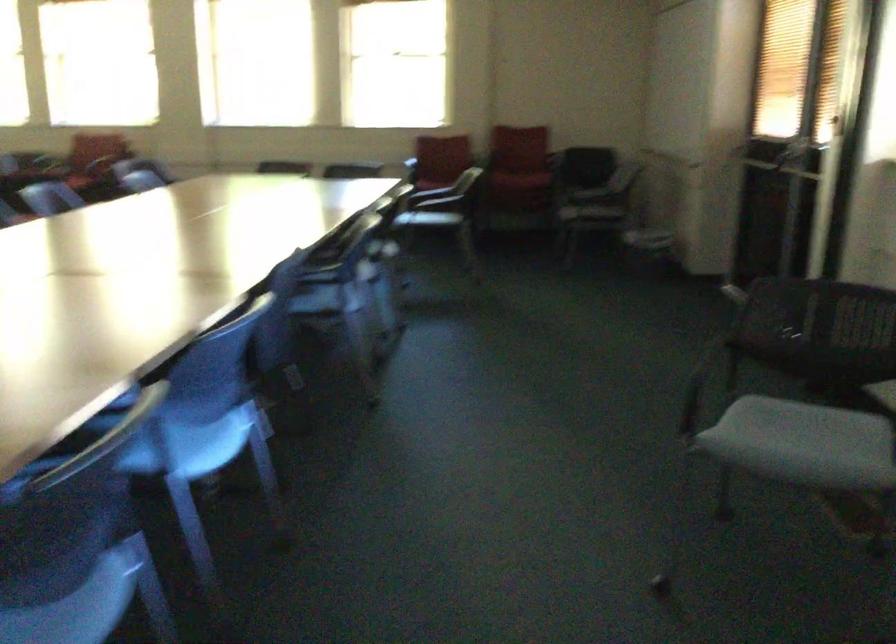
The image size is (896, 644). Identify the location of white chair sitting surface. (838, 444).